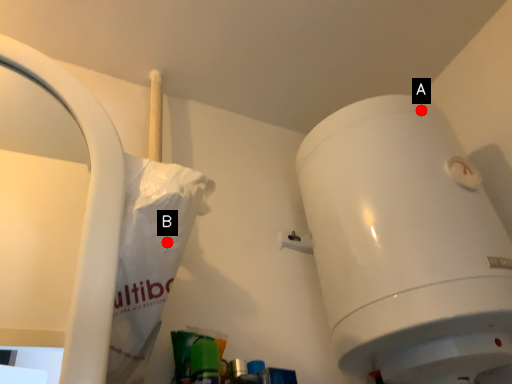
Question: Two points are circled on the image, labeled by A and B beside each circle. Which of the following is the closest to the observer?

Choices:
 (A) A is closer
 (B) B is closer

Answer: (B)